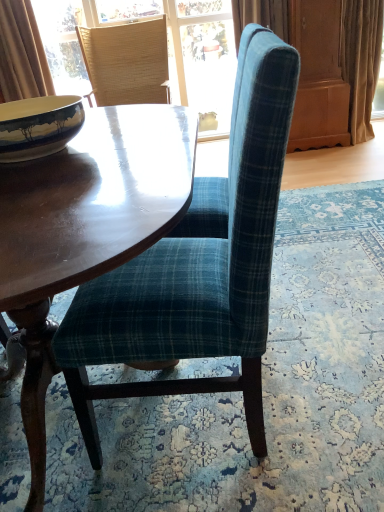
Question: Is teal plaid fabric chair at center, the 2th chair positioned from the top, to the left or to the right of brown velvet curtain at upper left, the second curtain viewed from the right, in the image?

Choices:
 (A) right
 (B) left

Answer: (A)

Question: From a real-world perspective, is teal plaid fabric chair at center, the first chair from the front, above or below brown velvet curtain at upper left, the 1th curtain positioned from the left?

Choices:
 (A) below
 (B) above

Answer: (A)

Question: Which object is the farthest from the shiny brown wood coffee table at center?

Choices:
 (A) brown velvet curtain at upper left, the second curtain viewed from the right
 (B) woven straw chair at upper left, positioned as the first chair in back-to-front order
 (C) beige fabric curtain at right, placed as the 1th curtain when sorted from right to left
 (D) matte ceramic bowl at left
 (E) teal plaid fabric chair at center, the first chair from the front

Answer: (C)

Question: Which is nearer to the shiny brown wood coffee table at center?

Choices:
 (A) beige fabric curtain at right, placed as the 1th curtain when sorted from right to left
 (B) brown velvet curtain at upper left, the 1th curtain positioned from the left
 (C) woven straw chair at upper left, positioned as the 1th chair in top-to-bottom order
 (D) matte ceramic bowl at left
 (E) teal plaid fabric chair at center, the first chair from the front

Answer: (D)